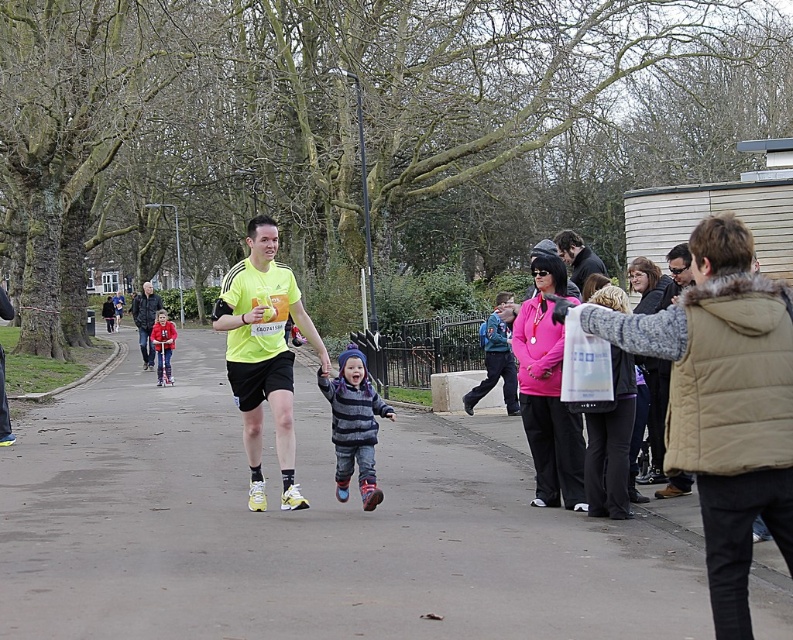
Between yellow matte running shirt at center and matte pink sweater at center, which one has less height?

matte pink sweater at center

Is yellow matte running shirt at center closer to camera compared to matte pink sweater at center?

Yes, it is.

Where is `yellow matte running shirt at center`? Image resolution: width=793 pixels, height=640 pixels. yellow matte running shirt at center is located at coordinates (263, 353).

Which of these two, pink fleece jacket at center or striped fleece jacket at center, stands shorter?

striped fleece jacket at center is shorter.

Locate an element on the screen. pink fleece jacket at center is located at coordinates (546, 394).

The width and height of the screenshot is (793, 640). In order to click on pink fleece jacket at center in this screenshot , I will do `click(546, 394)`.

The width and height of the screenshot is (793, 640). Describe the element at coordinates (305, 531) in the screenshot. I see `smooth asphalt road at center` at that location.

Can you confirm if smooth asphalt road at center is positioned below red fleece jacket at center?

Yes, smooth asphalt road at center is below red fleece jacket at center.

Image resolution: width=793 pixels, height=640 pixels. I want to click on smooth asphalt road at center, so click(305, 531).